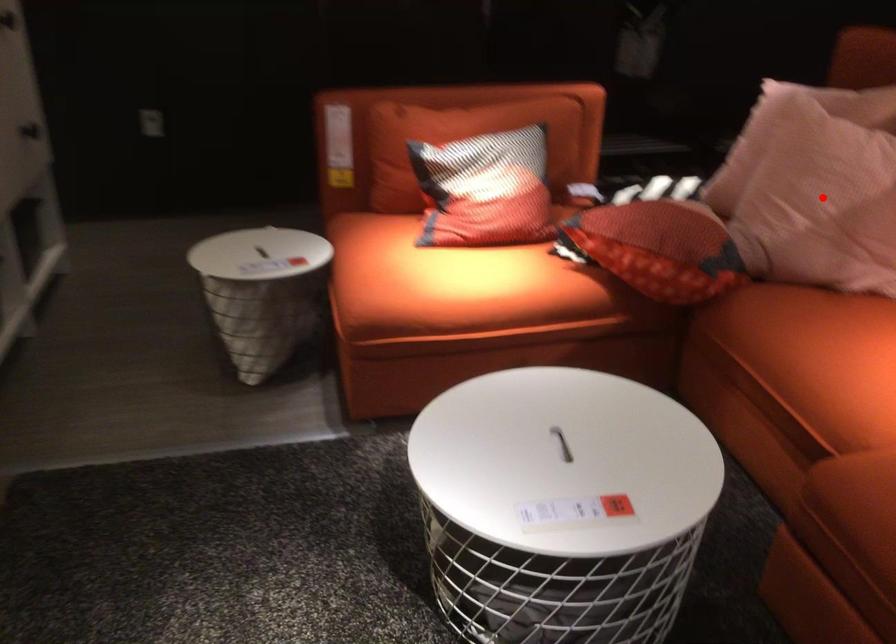
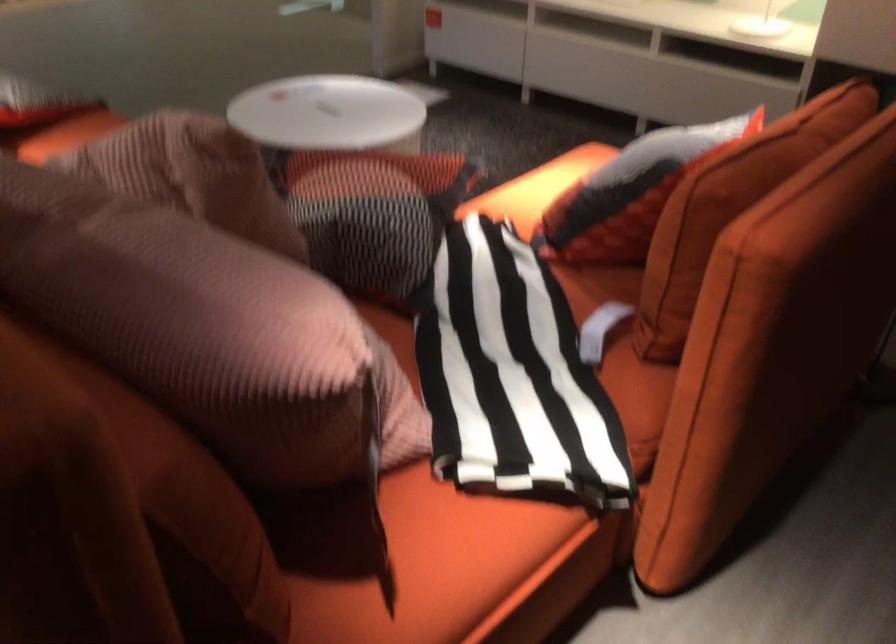
Question: I am providing you with two images of the same scene from different viewpoints. A red point is marked on the first image. At the location where the point appears in image 1, is it still visible in image 2?

Choices:
 (A) Yes
 (B) No

Answer: (B)